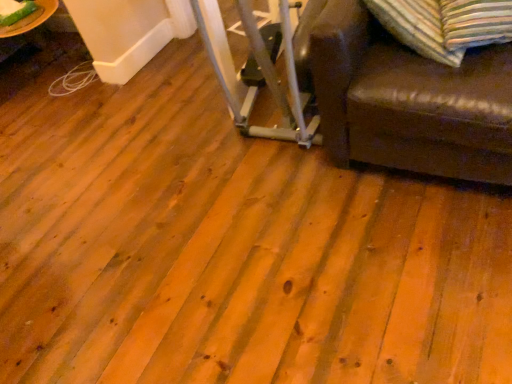
Question: Which is correct: striped fabric pillow at upper right is inside green glass plate at upper left, or outside of it?

Choices:
 (A) outside
 (B) inside

Answer: (A)

Question: Considering the positions of striped fabric pillow at upper right and green glass plate at upper left in the image, is striped fabric pillow at upper right taller or shorter than green glass plate at upper left?

Choices:
 (A) tall
 (B) short

Answer: (A)

Question: From the image's perspective, is striped fabric pillow at upper right positioned above or below green glass plate at upper left?

Choices:
 (A) above
 (B) below

Answer: (B)

Question: Considering the positions of green glass plate at upper left and striped fabric pillow at upper right in the image, is green glass plate at upper left taller or shorter than striped fabric pillow at upper right?

Choices:
 (A) tall
 (B) short

Answer: (B)

Question: From a real-world perspective, is green glass plate at upper left above or below striped fabric pillow at upper right?

Choices:
 (A) below
 (B) above

Answer: (A)

Question: Considering their positions, is green glass plate at upper left located in front of or behind striped fabric pillow at upper right?

Choices:
 (A) front
 (B) behind

Answer: (B)

Question: Looking at the image, does green glass plate at upper left seem bigger or smaller compared to striped fabric pillow at upper right?

Choices:
 (A) big
 (B) small

Answer: (B)